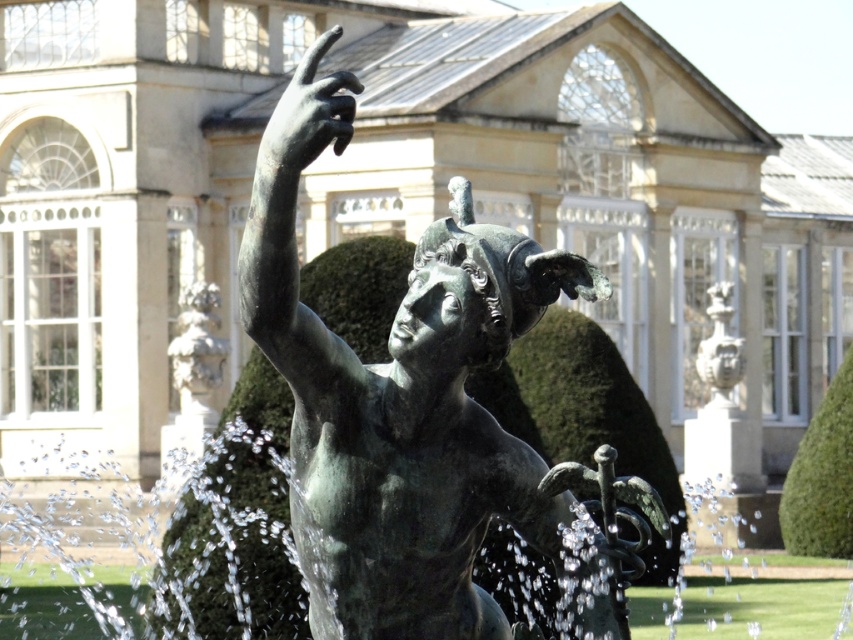
You are an architect designing a new fountain and want to ensure proper spacing between the bronze hand at upper center and the smooth white stone cherub at left. Based on the image, which object is wider?

The bronze hand at upper center is wider than the smooth white stone cherub at left according to the description.

Looking at this image, you are an art conservator assessing the space between the bronze statue at center and the polished bronze mask at upper right. If the statue is 3 meters wide, can you determine whether the space between them is sufficient to allow a 2.5 meter wide sculpture truck to pass through?

The bronze statue at center is wider than the polished bronze mask at upper right. However, the exact distance between them isn

You are an architect designing a new garden layout. You need to place a small decorative pot between the smooth white stone cherub at left and the polished bronze mask at upper right. Considering their sizes, which object should the pot be closer to?

The smooth white stone cherub at left is smaller than the polished bronze mask at upper right, so the pot should be placed closer to the polished bronze mask at upper right to balance their sizes.